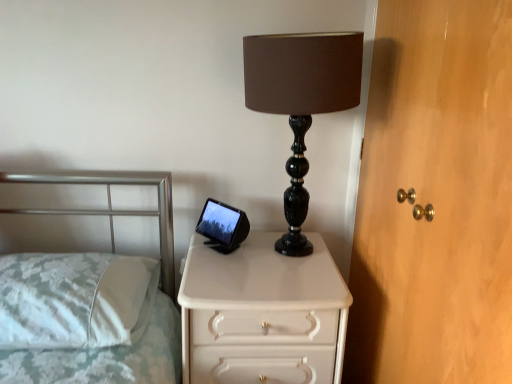
Question: In terms of size, does wooden dresser at right appear bigger or smaller than black marble lamp at center?

Choices:
 (A) big
 (B) small

Answer: (A)

Question: In terms of height, does wooden dresser at right look taller or shorter compared to black marble lamp at center?

Choices:
 (A) short
 (B) tall

Answer: (B)

Question: Considering the real-world distances, which object is farthest from the wooden dresser at right?

Choices:
 (A) white glossy chest of drawers at center
 (B) white fabric pillow at left
 (C) black marble lamp at center

Answer: (B)

Question: Which is nearer to the white fabric pillow at left?

Choices:
 (A) black marble lamp at center
 (B) white glossy chest of drawers at center
 (C) wooden dresser at right

Answer: (B)